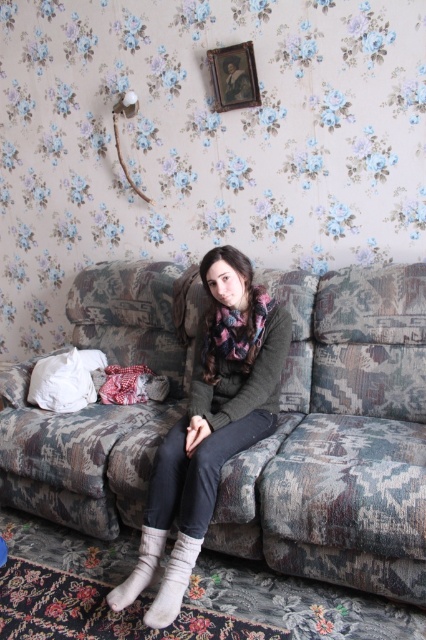
Is knit wool scarf at center bigger than white fluffy pillow at left?

Yes, knit wool scarf at center is bigger than white fluffy pillow at left.

Which is in front, point (199, 333) or point (86, 358)?

Point (199, 333) is more forward.

Does point (187, 528) come closer to viewer compared to point (66, 355)?

Yes, it is.

At what (x,y) coordinates should I click in order to perform the action: click on knit wool scarf at center. Please return your answer as a coordinate pair (x, y). Looking at the image, I should click on (210, 424).

Does point (58, 484) come closer to viewer compared to point (172, 584)?

No, (58, 484) is behind (172, 584).

Between camouflage fabric couch at center and white soft sock at lower center, which one is positioned lower?

Positioned lower is white soft sock at lower center.

Is point (134, 282) behind point (175, 541)?

Yes, point (134, 282) is farther from viewer.

I want to click on camouflage fabric couch at center, so click(x=340, y=438).

Does point (126, 586) come farther from viewer compared to point (147, 584)?

No, (126, 586) is in front of (147, 584).

Is knit wool scarf at center thinner than white fuzzy socks at lower center?

In fact, knit wool scarf at center might be wider than white fuzzy socks at lower center.

Locate an element on the screen. The height and width of the screenshot is (640, 426). knit wool scarf at center is located at coordinates pyautogui.click(x=210, y=424).

Find the location of a particular element. The width and height of the screenshot is (426, 640). knit wool scarf at center is located at coordinates (210, 424).